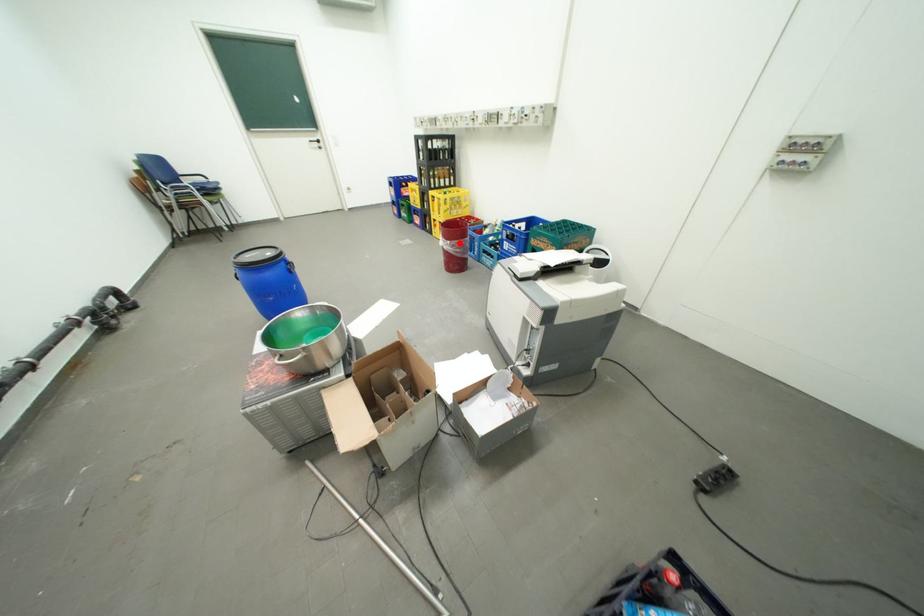
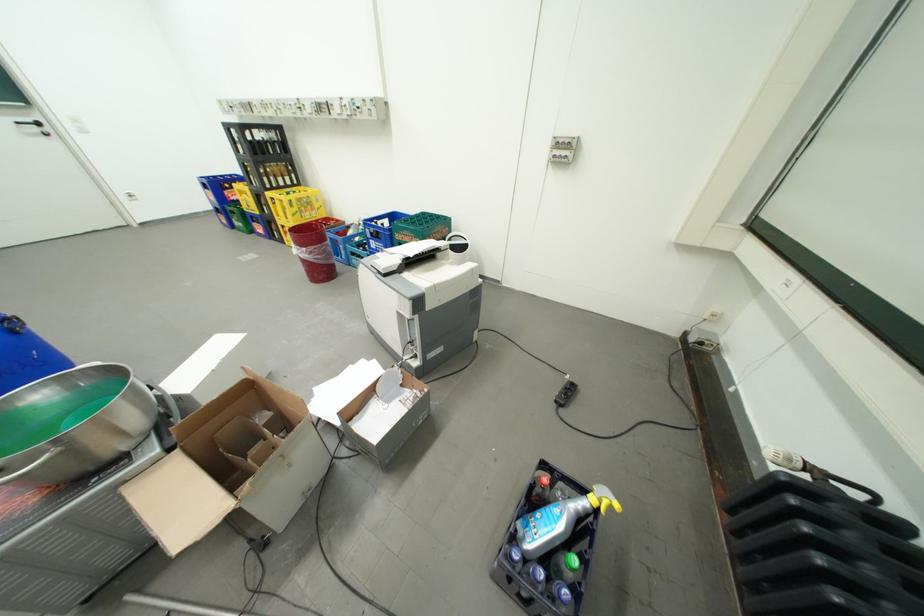
The point at the highlighted location is marked in the first image. Where is the corresponding point in the second image?

(314, 249)